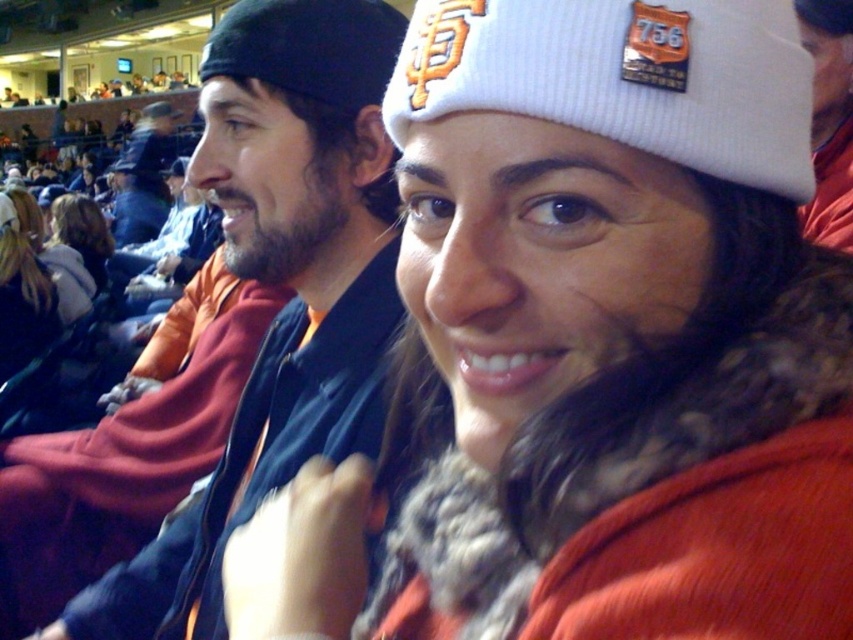
Question: Which point is closer to the camera taking this photo?

Choices:
 (A) (x=685, y=419)
 (B) (x=0, y=355)

Answer: (A)

Question: Is orange fur-lined jacket at center smaller than black knit cap at upper center?

Choices:
 (A) no
 (B) yes

Answer: (A)

Question: From the image, what is the correct spatial relationship of white knit cap at upper center in relation to blonde hair at center?

Choices:
 (A) below
 (B) above

Answer: (B)

Question: Which object appears farthest from the camera in this image?

Choices:
 (A) blonde hair at center
 (B) black knit cap at upper center
 (C) matte black jacket at center
 (D) white knit cap at upper center

Answer: (A)

Question: Which object appears closest to the camera in this image?

Choices:
 (A) orange fur-lined jacket at center
 (B) matte black jacket at center

Answer: (A)

Question: Does matte black jacket at center appear under white fur coat at center?

Choices:
 (A) yes
 (B) no

Answer: (A)